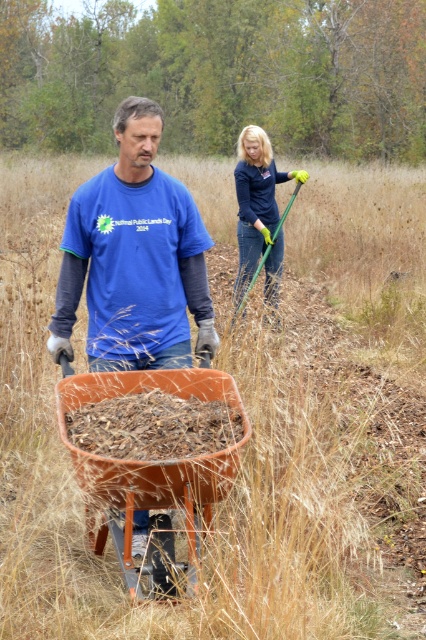
You are a photographer trying to capture a photo of the matte blue shirt at center and the dark blue fabric rake at upper right. If you want to ensure both are in focus, which object should you focus on first to get the best depth of field?

The matte blue shirt at center is shorter than the dark blue fabric rake at upper right, so you should focus on the dark blue fabric rake at upper right first to ensure both are in focus.

You are standing at the origin of the coordinate system in the image. You see two points labeled as point (x=196, y=211) and point (x=268, y=148). Which point is closer to you?

Point (x=196, y=211) is in front of point (x=268, y=148), so it is closer to you.